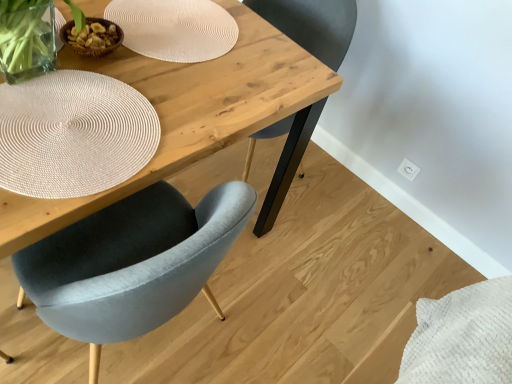
This screenshot has width=512, height=384. What are the coordinates of `vacant region to the right of white textured placemat at upper center, the 2th paper plate viewed from the front` in the screenshot? It's located at (267, 67).